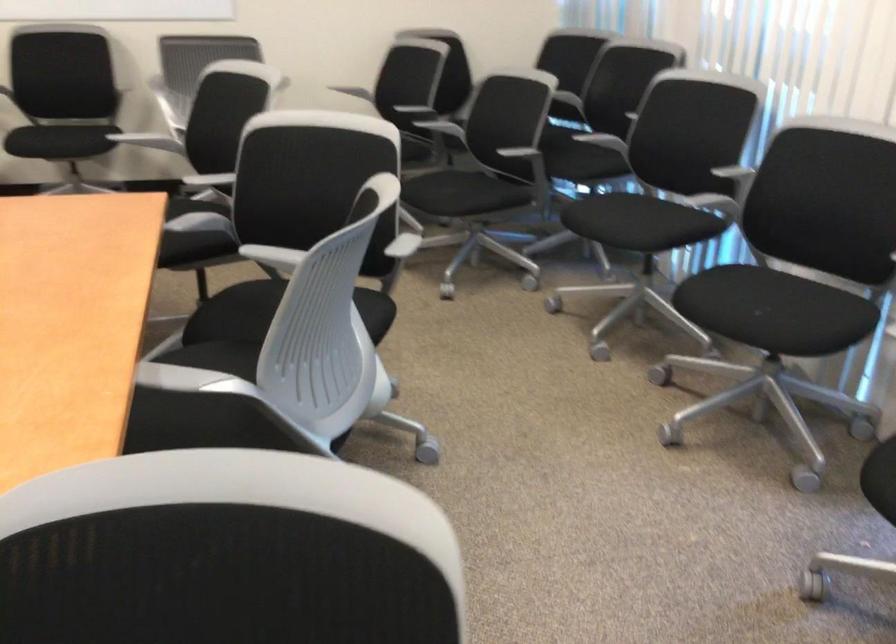
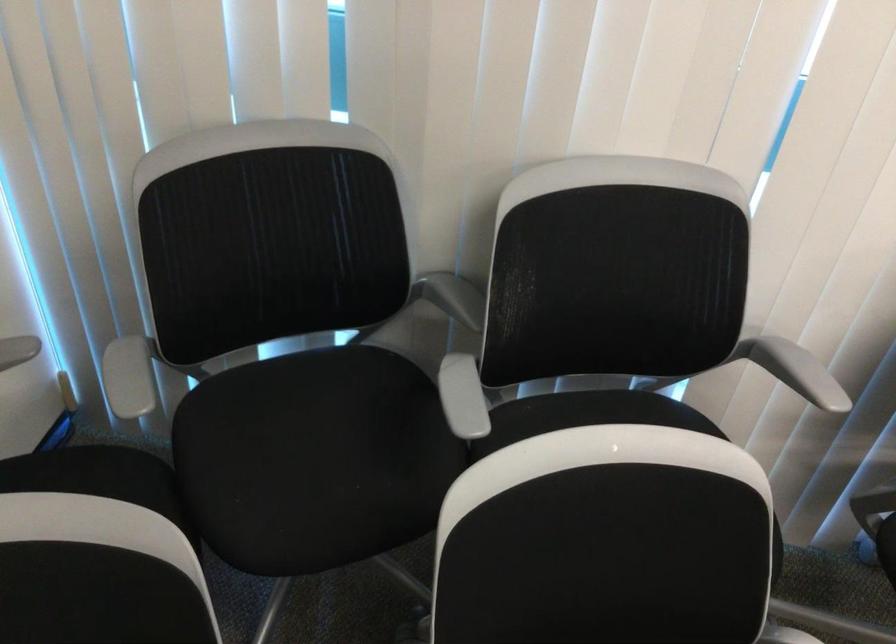
Question: I am providing you with two images of the same scene from different viewpoints. Please identify which objects are invisible in image2.

Choices:
 (A) wooden window handle
 (B) grey chair armrest
 (C) black chair sitting surface
 (D) white chair armrest

Answer: (D)